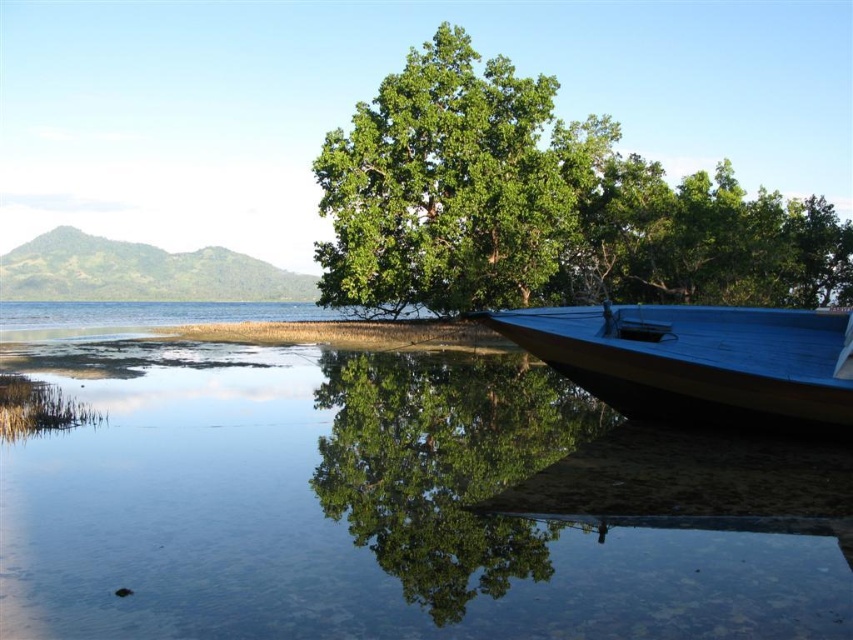
Does point (695, 540) come in front of point (424, 180)?

Yes, it is.

Which is below, clear water at lower left or green leafy tree at center?

clear water at lower left

Find the location of `clear water at lower left`. clear water at lower left is located at coordinates (343, 506).

Is clear water at lower left to the left of blue polished wood boat at lower right from the viewer's perspective?

Correct, you'll find clear water at lower left to the left of blue polished wood boat at lower right.

This screenshot has width=853, height=640. What do you see at coordinates (343, 506) in the screenshot?
I see `clear water at lower left` at bounding box center [343, 506].

Who is more forward, (x=7, y=492) or (x=798, y=336)?

Point (x=7, y=492) is more forward.

What are the coordinates of `clear water at lower left` in the screenshot? It's located at pyautogui.click(x=343, y=506).

Looking at this image, can you confirm if green leafy tree at center is shorter than blue polished wood boat at lower right?

No, green leafy tree at center is not shorter than blue polished wood boat at lower right.

Does point (572, 186) come closer to viewer compared to point (674, 376)?

No, (572, 186) is behind (674, 376).

Is point (717, 259) closer to camera compared to point (682, 401)?

That is False.

The height and width of the screenshot is (640, 853). In order to click on green leafy tree at center in this screenshot , I will do `click(543, 205)`.